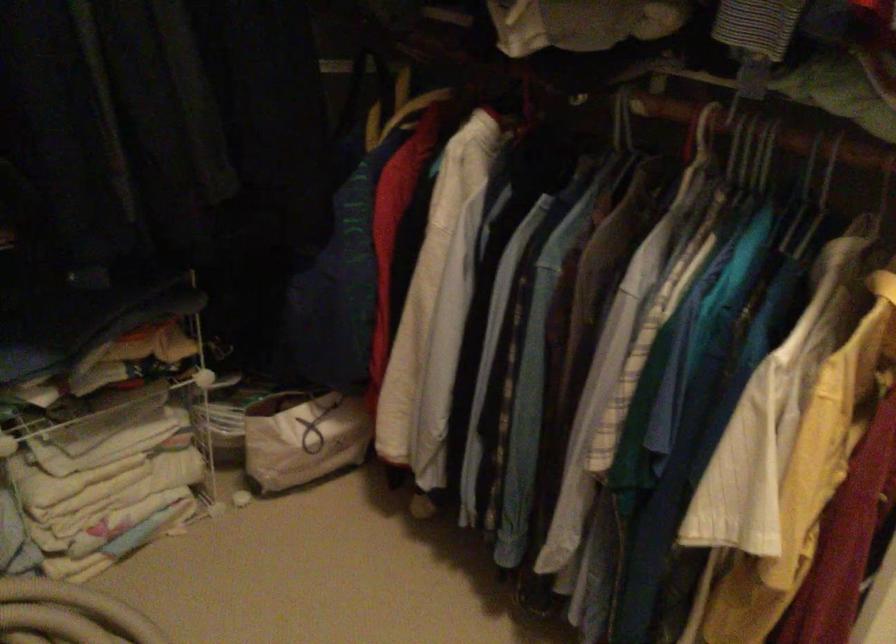
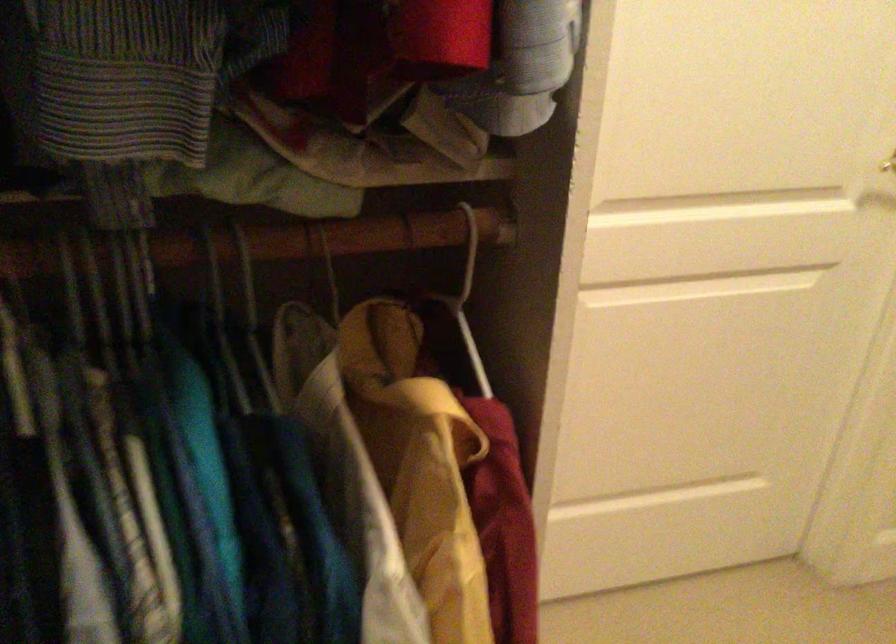
In the second image, find the point that corresponds to point (829, 172) in the first image.

(135, 245)